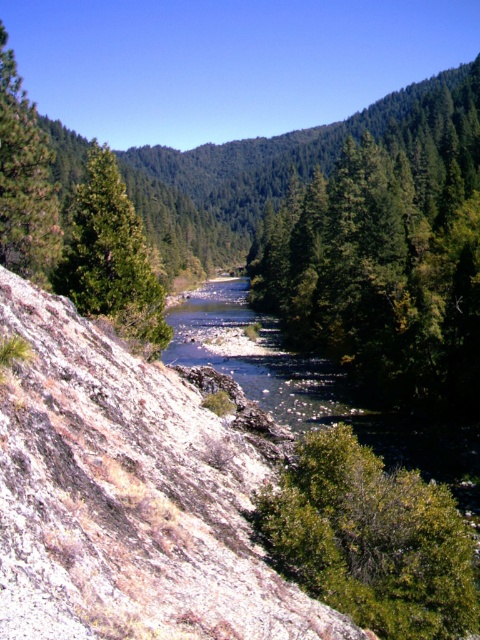
Does point (219, 497) come in front of point (15, 227)?

Yes, point (219, 497) is closer to viewer.

What do you see at coordinates (127, 497) in the screenshot?
I see `rocky at center` at bounding box center [127, 497].

Image resolution: width=480 pixels, height=640 pixels. I want to click on rocky at center, so click(x=127, y=497).

Is green leafy tree at lower right further to camera compared to green matte tree at upper left?

No, it is in front of green matte tree at upper left.

Which is more to the left, green leafy tree at lower right or green matte tree at upper left?

From the viewer's perspective, green matte tree at upper left appears more on the left side.

You are a GUI agent. You are given a task and a screenshot of the screen. Output one action in this format:
    pyautogui.click(x=<x>, y=<y>)
    Task: Click on the green leafy tree at lower right
    
    Given the screenshot: What is the action you would take?
    pyautogui.click(x=371, y=540)

Is the position of rocky at center less distant than that of green matte tree at upper left?

Yes.

Is rocky at center bigger than green matte tree at upper left?

Incorrect, rocky at center is not larger than green matte tree at upper left.

Is point (122, 481) more distant than point (74, 301)?

No, it is in front of (74, 301).

This screenshot has width=480, height=640. What are the coordinates of `rocky at center` in the screenshot? It's located at (127, 497).